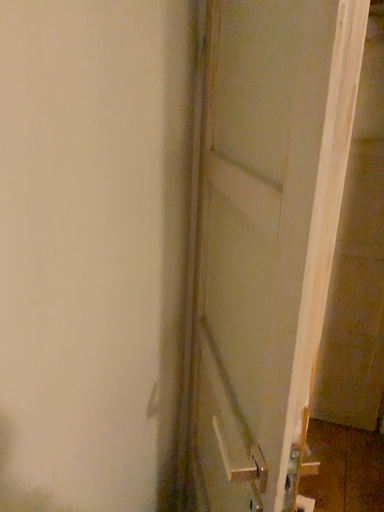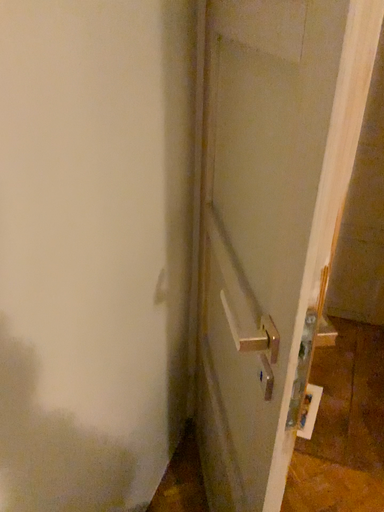
Question: How did the camera likely rotate when shooting the video?

Choices:
 (A) rotated upward
 (B) rotated downward

Answer: (B)